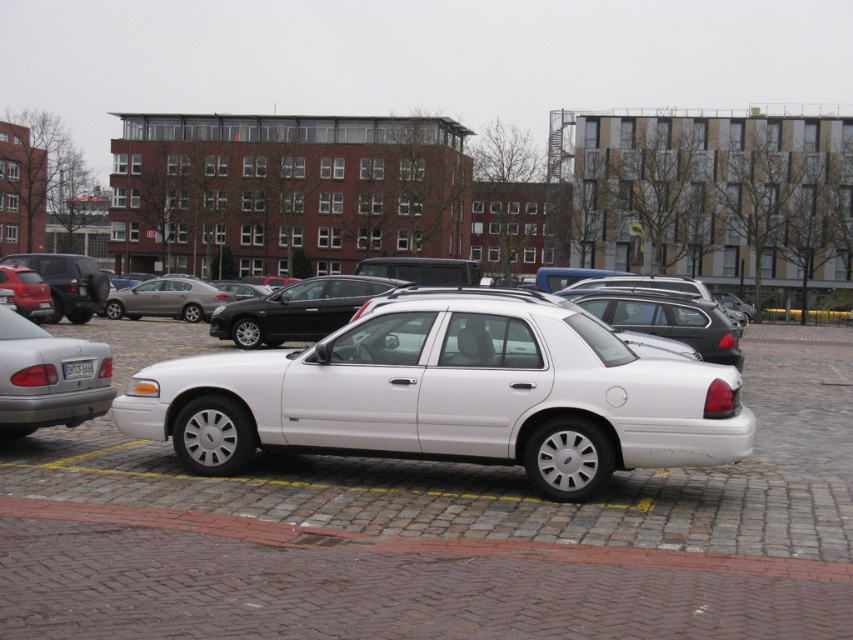
You are a delivery person trying to park your van which is 2 meters wide in the parking lot. You see the silver metallic sedan at left and the satin black sedan at center. Which parking space between them can accommodate your van?

The satin black sedan at center has a wider parking space available since it is wider than the silver metallic sedan at left, so the parking space next to the satin black sedan at center can accommodate your van which is 2 meters wide.

You are a delivery person needing to park your van between the white glossy sedan at center and the silver metallic sedan at left. Can you park your van there if the space between them is exactly 3 meters wide?

The white glossy sedan at center is closer to the viewer than the silver metallic sedan at left, so the distance between them appears wider than it actually is. However, since the space between them is exactly 3 meters, you can park your van there as long as it fits within that width.